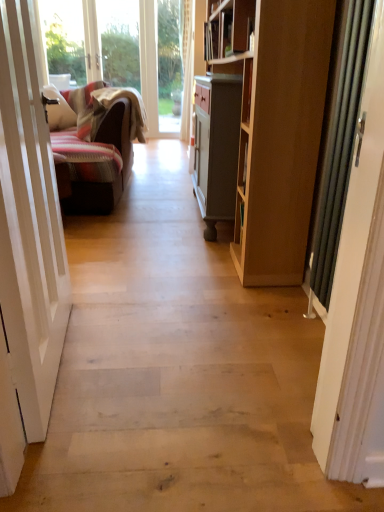
Question: Is metallic silver door at right, which appears as the first door when viewed from the right, at the back of white glossy door at left, which ranks as the 1th door in left-to-right order?

Choices:
 (A) no
 (B) yes

Answer: (A)

Question: Is white glossy door at left, which appears as the second door when viewed from the right, further to the viewer compared to metallic silver door at right, which appears as the first door when viewed from the right?

Choices:
 (A) no
 (B) yes

Answer: (A)

Question: Does white glossy door at left, which appears as the second door when viewed from the right, have a lesser width compared to metallic silver door at right, placed as the second door when sorted from left to right?

Choices:
 (A) no
 (B) yes

Answer: (A)

Question: Is the depth of white glossy door at left, which appears as the second door when viewed from the right, less than that of metallic silver door at right, placed as the second door when sorted from left to right?

Choices:
 (A) yes
 (B) no

Answer: (A)

Question: Could metallic silver door at right, placed as the second door when sorted from left to right, be considered to be inside white glossy door at left, which appears as the second door when viewed from the right?

Choices:
 (A) yes
 (B) no

Answer: (B)

Question: Is white glossy door at left, which ranks as the 1th door in left-to-right order, at the left side of metallic silver door at right, which appears as the first door when viewed from the right?

Choices:
 (A) yes
 (B) no

Answer: (A)

Question: Is natural wood floor at center not inside white glossy door at left, which ranks as the 1th door in left-to-right order?

Choices:
 (A) yes
 (B) no

Answer: (A)

Question: Is natural wood floor at center shorter than white glossy door at left, which ranks as the 1th door in left-to-right order?

Choices:
 (A) yes
 (B) no

Answer: (A)

Question: Is natural wood floor at center taller than white glossy door at left, which ranks as the 1th door in left-to-right order?

Choices:
 (A) no
 (B) yes

Answer: (A)

Question: Are natural wood floor at center and white glossy door at left, which ranks as the 1th door in left-to-right order, beside each other?

Choices:
 (A) no
 (B) yes

Answer: (A)

Question: Considering the relative positions of natural wood floor at center and white glossy door at left, which ranks as the 1th door in left-to-right order, in the image provided, is natural wood floor at center to the right of white glossy door at left, which ranks as the 1th door in left-to-right order, from the viewer's perspective?

Choices:
 (A) yes
 (B) no

Answer: (A)

Question: From a real-world perspective, is natural wood floor at center beneath white glossy door at left, which appears as the second door when viewed from the right?

Choices:
 (A) yes
 (B) no

Answer: (A)

Question: Is white glossy door at left, which ranks as the 1th door in left-to-right order, taller than natural wood floor at center?

Choices:
 (A) yes
 (B) no

Answer: (A)